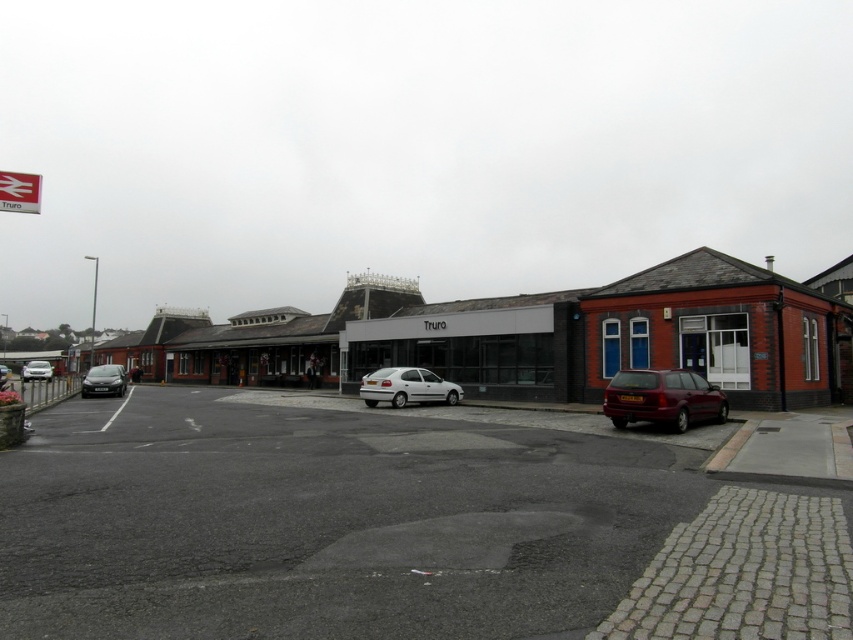
Is black asphalt parking lot at center to the right of white matte hatchback at center from the viewer's perspective?

Correct, you'll find black asphalt parking lot at center to the right of white matte hatchback at center.

Can you confirm if black asphalt parking lot at center is taller than white matte hatchback at center?

Indeed, black asphalt parking lot at center has a greater height compared to white matte hatchback at center.

At what (x,y) coordinates should I click in order to perform the action: click on black asphalt parking lot at center. Please return your answer as a coordinate pair (x, y). This screenshot has width=853, height=640. Looking at the image, I should click on (396, 529).

Does shiny black car at left lie in front of silver metallic car at left?

That is True.

This screenshot has height=640, width=853. Find the location of `shiny black car at left`. shiny black car at left is located at coordinates (103, 380).

The width and height of the screenshot is (853, 640). I want to click on shiny black car at left, so click(103, 380).

Which is above, brick building at center or white glass building at center?

brick building at center is higher up.

Who is shorter, brick building at center or white glass building at center?

With less height is white glass building at center.

Which is in front, point (450, 336) or point (379, 321)?

Point (450, 336) is in front.

You are a GUI agent. You are given a task and a screenshot of the screen. Output one action in this format:
    pyautogui.click(x=<x>, y=<y>)
    Task: Click on the brick building at center
    Image resolution: width=853 pixels, height=640 pixels.
    Given the screenshot: What is the action you would take?
    pyautogui.click(x=537, y=337)